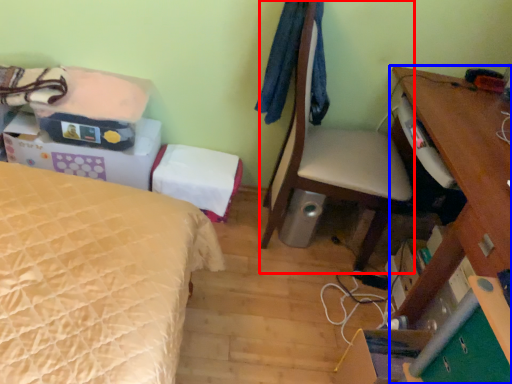
Question: Which object appears farthest to the camera in this image, chair (highlighted by a red box) or desk (highlighted by a blue box)?

Choices:
 (A) chair
 (B) desk

Answer: (A)